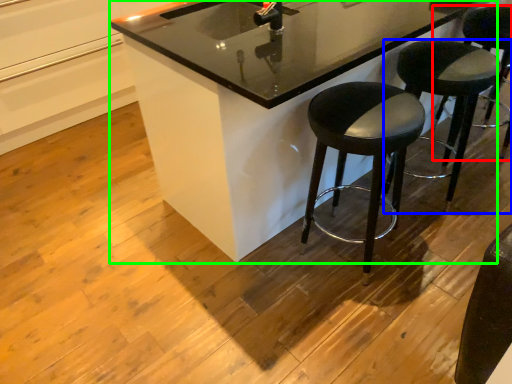
Question: Which is nearer to the stool (highlighted by a red box)? stool (highlighted by a blue box) or counter (highlighted by a green box).

Choices:
 (A) stool
 (B) counter

Answer: (A)